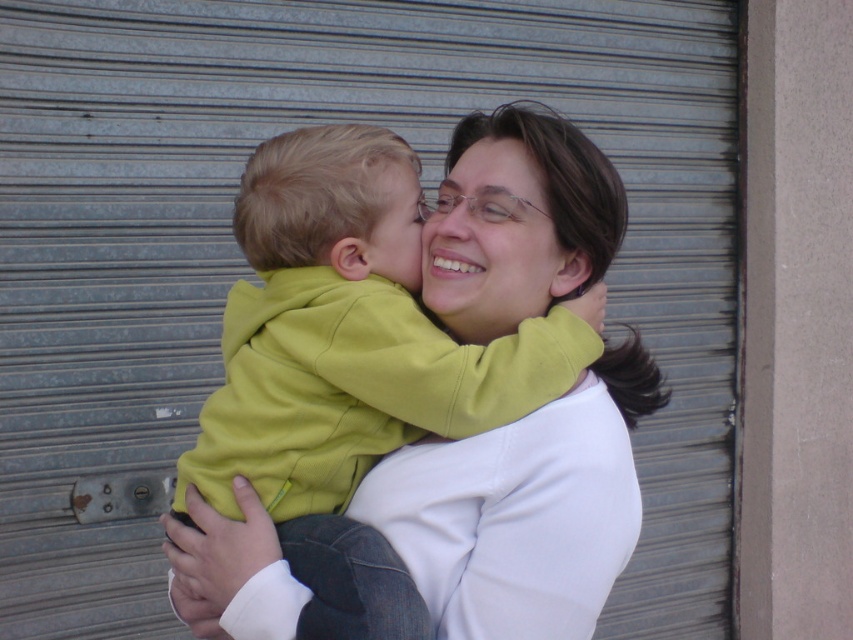
Question: Is matte yellow face at center wider than matte green hoodie at center?

Choices:
 (A) no
 (B) yes

Answer: (B)

Question: Does green fleece jacket at center come behind matte yellow face at center?

Choices:
 (A) no
 (B) yes

Answer: (A)

Question: Can you confirm if green fleece jacket at center is positioned to the left of matte yellow face at center?

Choices:
 (A) no
 (B) yes

Answer: (B)

Question: Which of the following is the farthest from the observer?

Choices:
 (A) matte yellow face at center
 (B) green fleece jacket at center
 (C) matte green hoodie at center

Answer: (C)

Question: Among these objects, which one is nearest to the camera?

Choices:
 (A) matte yellow face at center
 (B) green fleece jacket at center
 (C) matte green hoodie at center

Answer: (B)

Question: Estimate the real-world distances between objects in this image. Which object is farther from the green fleece jacket at center?

Choices:
 (A) matte green hoodie at center
 (B) matte yellow face at center

Answer: (A)